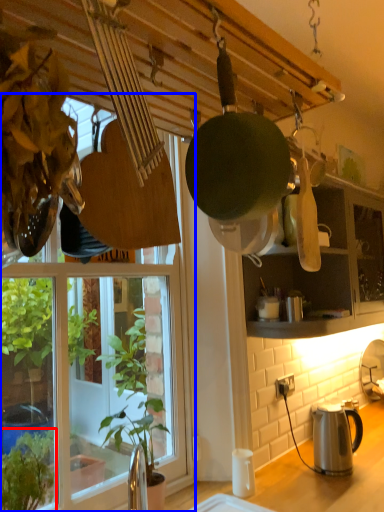
Question: Which point is closer to the camera, houseplant (highlighted by a red box) or window (highlighted by a blue box)?

Choices:
 (A) houseplant
 (B) window

Answer: (B)